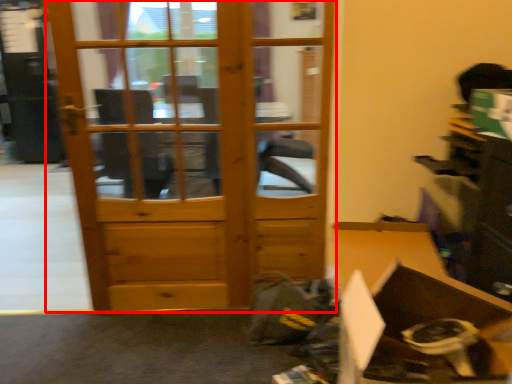
Question: From the image's perspective, what is the correct spatial positioning of door (annotated by the red box) in reference to cardboard box?

Choices:
 (A) below
 (B) above

Answer: (B)